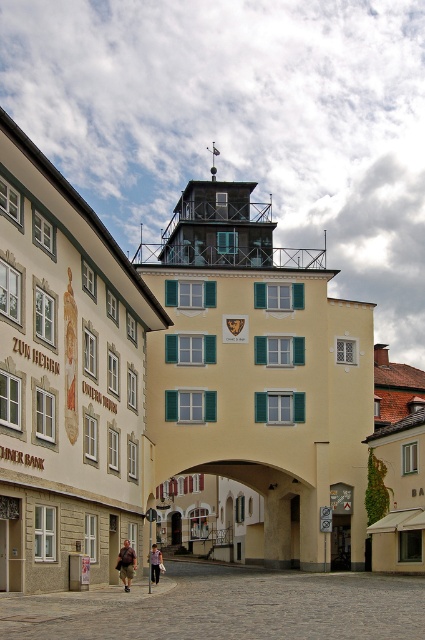
Is matte black tower at upper center above brown leather jacket at lower center?

Correct, matte black tower at upper center is located above brown leather jacket at lower center.

Find the location of a particular element. This screenshot has width=425, height=640. matte black tower at upper center is located at coordinates (260, 372).

The width and height of the screenshot is (425, 640). What are the coordinates of `matte black tower at upper center` in the screenshot? It's located at (260, 372).

Consider the image. Between matte black tower at upper center and light brown leather jacket at lower center, which one appears on the right side from the viewer's perspective?

From the viewer's perspective, matte black tower at upper center appears more on the right side.

At what (x,y) coordinates should I click in order to perform the action: click on matte black tower at upper center. Please return your answer as a coordinate pair (x, y). Looking at the image, I should click on (260, 372).

The image size is (425, 640). Identify the location of matte black tower at upper center. (260, 372).

Does brown leather jacket at lower center have a smaller size compared to light brown leather jacket at lower center?

Indeed, brown leather jacket at lower center has a smaller size compared to light brown leather jacket at lower center.

Can you confirm if brown leather jacket at lower center is wider than light brown leather jacket at lower center?

In fact, brown leather jacket at lower center might be narrower than light brown leather jacket at lower center.

This screenshot has height=640, width=425. Describe the element at coordinates (127, 563) in the screenshot. I see `brown leather jacket at lower center` at that location.

Where is `brown leather jacket at lower center`? Image resolution: width=425 pixels, height=640 pixels. brown leather jacket at lower center is located at coordinates (127, 563).